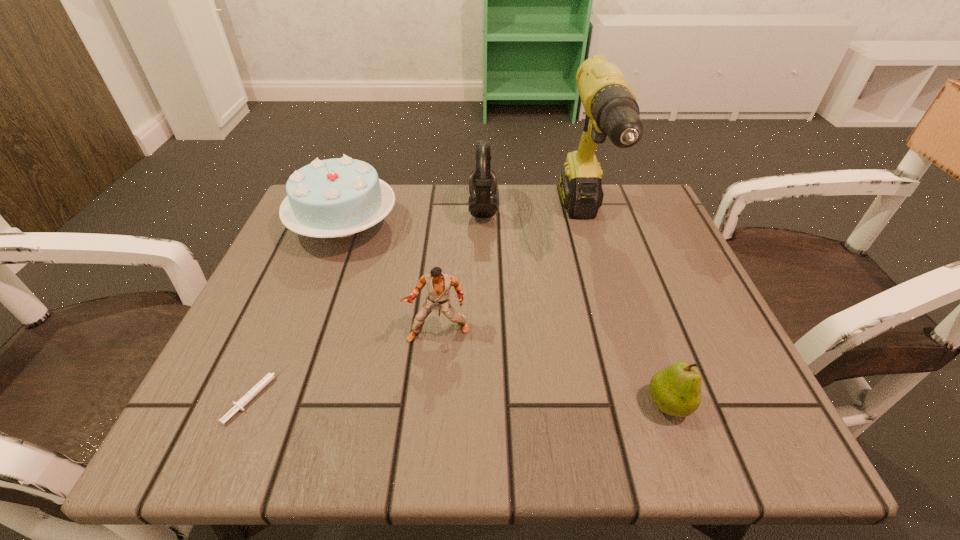
In order to click on vacant position at the right edge of the desktop in this screenshot , I will do `click(637, 318)`.

Find the location of a particular element. The height and width of the screenshot is (540, 960). vacant space at the near left corner is located at coordinates 225,404.

The width and height of the screenshot is (960, 540). I want to click on blank region between the birthday cake and the puncher, so click(392, 279).

Where is `vacant point located between the syringe and the headset`? vacant point located between the syringe and the headset is located at coordinates click(x=370, y=301).

The width and height of the screenshot is (960, 540). I want to click on free space between the shortest object and the headset, so click(370, 301).

The image size is (960, 540). I want to click on free space that is in between the puncher and the headset, so click(461, 271).

At what (x,y) coordinates should I click in order to perform the action: click on free spot between the fourth farthest object and the headset. Please return your answer as a coordinate pair (x, y). Looking at the image, I should click on (461, 271).

Locate an element on the screen. The height and width of the screenshot is (540, 960). vacant space that's between the drill and the headset is located at coordinates (534, 218).

Locate an element on the screen. vacant space that's between the shortest object and the headset is located at coordinates (370, 301).

You are a GUI agent. You are given a task and a screenshot of the screen. Output one action in this format:
    pyautogui.click(x=<x>, y=<y>)
    Task: Click on the vacant area between the syringe and the birthday cake
    This screenshot has width=960, height=540.
    Given the screenshot: What is the action you would take?
    [300, 309]